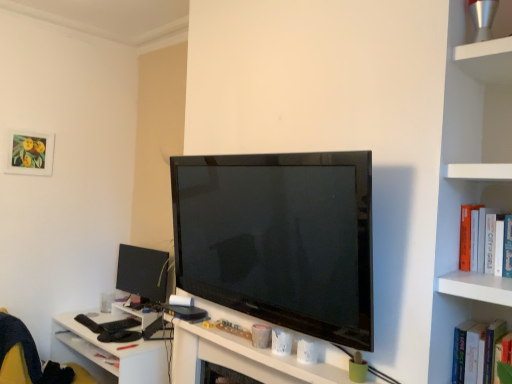
Question: Considering the relative sizes of matte paper picture frame at upper left and white glossy table at lower left in the image provided, is matte paper picture frame at upper left smaller than white glossy table at lower left?

Choices:
 (A) yes
 (B) no

Answer: (A)

Question: Does matte paper picture frame at upper left have a greater height compared to white glossy table at lower left?

Choices:
 (A) no
 (B) yes

Answer: (A)

Question: Is matte paper picture frame at upper left outside of white glossy table at lower left?

Choices:
 (A) no
 (B) yes

Answer: (B)

Question: Would you consider matte paper picture frame at upper left to be distant from white glossy table at lower left?

Choices:
 (A) yes
 (B) no

Answer: (A)

Question: Does matte paper picture frame at upper left appear on the right side of white glossy table at lower left?

Choices:
 (A) yes
 (B) no

Answer: (B)

Question: From a real-world perspective, is matte paper picture frame at upper left above or below matte black monitor at lower left?

Choices:
 (A) above
 (B) below

Answer: (A)

Question: Considering the positions of matte paper picture frame at upper left and matte black monitor at lower left in the image, is matte paper picture frame at upper left bigger or smaller than matte black monitor at lower left?

Choices:
 (A) big
 (B) small

Answer: (B)

Question: Considering the positions of matte paper picture frame at upper left and matte black monitor at lower left in the image, is matte paper picture frame at upper left wider or thinner than matte black monitor at lower left?

Choices:
 (A) thin
 (B) wide

Answer: (A)

Question: Is matte paper picture frame at upper left inside the boundaries of matte black monitor at lower left, or outside?

Choices:
 (A) outside
 (B) inside

Answer: (A)

Question: Is point (95, 372) closer or farther from the camera than point (247, 321)?

Choices:
 (A) farther
 (B) closer

Answer: (A)

Question: Considering the positions of white glossy table at lower left and white matte computer desk at center in the image, is white glossy table at lower left taller or shorter than white matte computer desk at center?

Choices:
 (A) tall
 (B) short

Answer: (A)

Question: From the image's perspective, is white glossy table at lower left positioned above or below white matte computer desk at center?

Choices:
 (A) below
 (B) above

Answer: (A)

Question: Which is correct: white glossy table at lower left is inside white matte computer desk at center, or outside of it?

Choices:
 (A) inside
 (B) outside

Answer: (B)

Question: From the image's perspective, is matte black monitor at lower left above or below matte paper picture frame at upper left?

Choices:
 (A) below
 (B) above

Answer: (A)

Question: Looking at the image, does matte black monitor at lower left seem bigger or smaller compared to matte paper picture frame at upper left?

Choices:
 (A) small
 (B) big

Answer: (B)